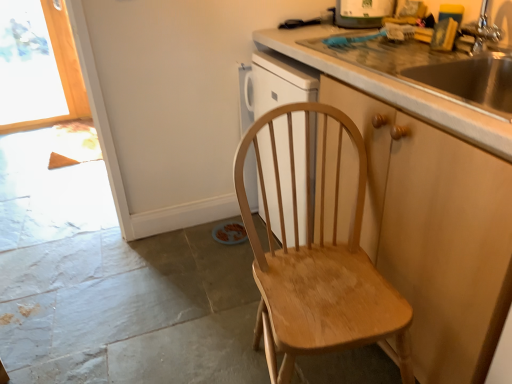
This screenshot has width=512, height=384. In order to click on white glossy dishwasher at upper center in this screenshot , I will do `click(362, 13)`.

What is the approximate height of silver metallic faucet at upper right?

silver metallic faucet at upper right is 10.89 inches tall.

This screenshot has width=512, height=384. What are the coordinates of `white glossy dishwasher at upper center` in the screenshot? It's located at (362, 13).

In terms of height, does white glossy dishwasher at upper center look taller or shorter compared to light brown wooden chair at center?

In the image, white glossy dishwasher at upper center appears to be shorter than light brown wooden chair at center.

Would you say white glossy dishwasher at upper center is a long distance from light brown wooden chair at center?

That's right, there is a large distance between white glossy dishwasher at upper center and light brown wooden chair at center.

Between white glossy dishwasher at upper center and light brown wooden chair at center, which one is positioned in front?

light brown wooden chair at center is closer to the camera.

Where is `faucet that is above the light brown wooden chair at center (from the image's perspective)`? faucet that is above the light brown wooden chair at center (from the image's perspective) is located at coordinates (482, 30).

Considering the positions of objects light brown wooden chair at center and silver metallic faucet at upper right in the image provided, who is more to the right, light brown wooden chair at center or silver metallic faucet at upper right?

silver metallic faucet at upper right is more to the right.

From the image's perspective, is wooden cabinet at right located beneath light brown wooden chair at center?

No.

From a real-world perspective, does wooden cabinet at right sit lower than light brown wooden chair at center?

Actually, wooden cabinet at right is physically above light brown wooden chair at center in the real world.

Considering the relative sizes of wooden cabinet at right and light brown wooden chair at center in the image provided, is wooden cabinet at right shorter than light brown wooden chair at center?

In fact, wooden cabinet at right may be taller than light brown wooden chair at center.

Is wooden cabinet at right oriented away from light brown wooden chair at center?

That's right, wooden cabinet at right is facing away from light brown wooden chair at center.

From a real-world perspective, which object rests below the other?

From a 3D spatial view, white glossy dishwasher at upper center is below.

From the image's perspective, is white glossy dishwasher at upper center above silver metallic faucet at upper right?

Correct, white glossy dishwasher at upper center appears higher than silver metallic faucet at upper right in the image.

In terms of width, does white glossy dishwasher at upper center look wider or thinner when compared to silver metallic faucet at upper right?

Clearly, white glossy dishwasher at upper center has more width compared to silver metallic faucet at upper right.

Is white glossy dishwasher at upper center shorter than silver metallic faucet at upper right?

Yes.

Find the location of a particular element. Image resolution: width=512 pixels, height=384 pixels. kitchen appliance that appears above the wooden cabinet at right (from a real-world perspective) is located at coordinates (362, 13).

In the image, is wooden cabinet at right positioned in front of or behind white glossy dishwasher at upper center?

Visually, wooden cabinet at right is located in front of white glossy dishwasher at upper center.

Is wooden cabinet at right far away from white glossy dishwasher at upper center?

wooden cabinet at right is far away from white glossy dishwasher at upper center.

What's the angular difference between wooden cabinet at right and white glossy dishwasher at upper center's facing directions?

The facing directions of wooden cabinet at right and white glossy dishwasher at upper center are 0.438 degrees apart.

From the image's perspective, between silver metallic faucet at upper right and wooden cabinet at right, which one is located above?

silver metallic faucet at upper right appears higher in the image.

In terms of height, does silver metallic faucet at upper right look taller or shorter compared to wooden cabinet at right?

silver metallic faucet at upper right is shorter than wooden cabinet at right.

Is wooden cabinet at right located within silver metallic faucet at upper right?

No, silver metallic faucet at upper right does not contain wooden cabinet at right.

Is silver metallic faucet at upper right at the left side of wooden cabinet at right?

No.

Does point (298, 350) come behind point (64, 17)?

No, it is in front of (64, 17).

Do you think light brown wooden chair at center is within transparent glass window at upper left, or outside of it?

light brown wooden chair at center is spatially situated outside transparent glass window at upper left.

Does light brown wooden chair at center come in front of transparent glass window at upper left?

Yes, light brown wooden chair at center is closer to the viewer.

Is light brown wooden chair at center facing towards transparent glass window at upper left?

No, light brown wooden chair at center is not aimed at transparent glass window at upper left.

Identify the location of kitchen appliance lying behind the light brown wooden chair at center. (362, 13).

Where is `chair on the left of silver metallic faucet at upper right`? chair on the left of silver metallic faucet at upper right is located at coordinates (318, 266).

Considering their positions, is wooden cabinet at right positioned closer to light brown wooden chair at center than silver metallic faucet at upper right?

wooden cabinet at right is closer to light brown wooden chair at center.

From the image, which object appears to be nearer to transparent glass window at upper left, wooden cabinet at right or silver metallic faucet at upper right?

wooden cabinet at right lies closer to transparent glass window at upper left than the other object.

Which object lies further to the anchor point silver metallic faucet at upper right, white glossy dishwasher at upper center or transparent glass window at upper left?

transparent glass window at upper left lies further to silver metallic faucet at upper right than the other object.

Based on their spatial positions, is transparent glass window at upper left or white glossy dishwasher at upper center further from silver metallic faucet at upper right?

transparent glass window at upper left lies further to silver metallic faucet at upper right than the other object.

Based on their spatial positions, is transparent glass window at upper left or light brown wooden chair at center closer to wooden cabinet at right?

Based on the image, light brown wooden chair at center appears to be nearer to wooden cabinet at right.

Which object lies nearer to the anchor point wooden cabinet at right, silver metallic faucet at upper right or transparent glass window at upper left?

Based on the image, silver metallic faucet at upper right appears to be nearer to wooden cabinet at right.

Estimate the real-world distances between objects in this image. Which object is further from white glossy dishwasher at upper center, wooden cabinet at right or transparent glass window at upper left?

transparent glass window at upper left is further to white glossy dishwasher at upper center.

Looking at the image, which one is located closer to silver metallic faucet at upper right, transparent glass window at upper left or light brown wooden chair at center?

The object closer to silver metallic faucet at upper right is light brown wooden chair at center.

At what (x,y) coordinates should I click in order to perform the action: click on chair between transparent glass window at upper left and silver metallic faucet at upper right. Please return your answer as a coordinate pair (x, y). The height and width of the screenshot is (384, 512). Looking at the image, I should click on (318, 266).

Where is `chair between wooden cabinet at right and white glossy dishwasher at upper center from front to back`? The height and width of the screenshot is (384, 512). chair between wooden cabinet at right and white glossy dishwasher at upper center from front to back is located at coordinates (318, 266).

You are a GUI agent. You are given a task and a screenshot of the screen. Output one action in this format:
    pyautogui.click(x=<x>, y=<y>)
    Task: Click on the cabinetry situated between transparent glass window at upper left and silver metallic faucet at upper right from left to right
    
    Given the screenshot: What is the action you would take?
    pyautogui.click(x=436, y=234)

Identify the location of kitchen appliance situated between transparent glass window at upper left and silver metallic faucet at upper right from left to right. (362, 13).